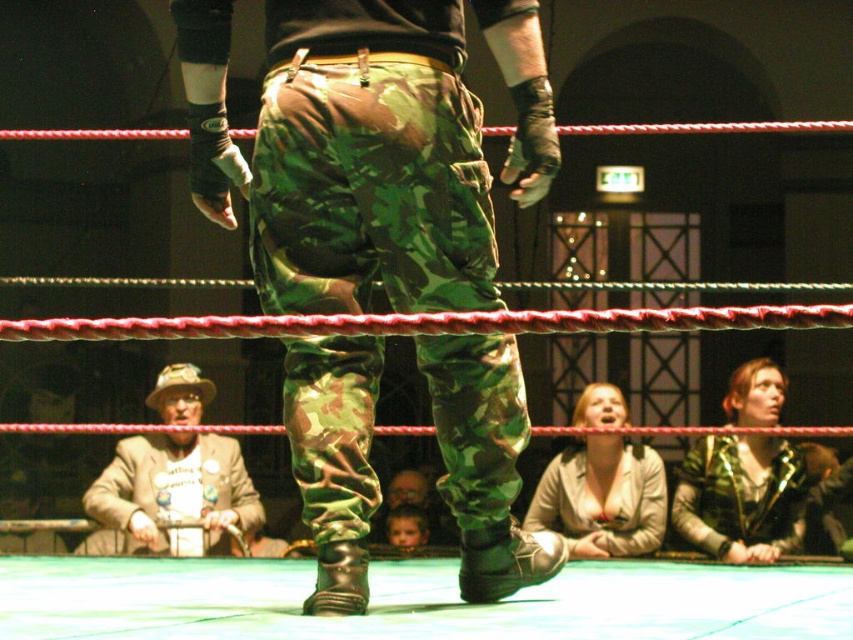
Question: Among these points, which one is farthest from the camera?

Choices:
 (A) (585, 550)
 (B) (318, 448)

Answer: (A)

Question: Which of these objects is positioned farthest from the leather jacket at lower center?

Choices:
 (A) camo pants at center
 (B) light brown leather jacket at lower left

Answer: (A)

Question: Is camo pants at center to the left of light brown leather jacket at lower left from the viewer's perspective?

Choices:
 (A) yes
 (B) no

Answer: (B)

Question: Is camo pants at center in front of light brown leather jacket at lower left?

Choices:
 (A) no
 (B) yes

Answer: (B)

Question: Which point is farther from the camera taking this photo?

Choices:
 (A) (573, 477)
 (B) (190, 371)

Answer: (B)

Question: Can you confirm if camo pants at center is bigger than leather jacket at lower center?

Choices:
 (A) yes
 (B) no

Answer: (A)